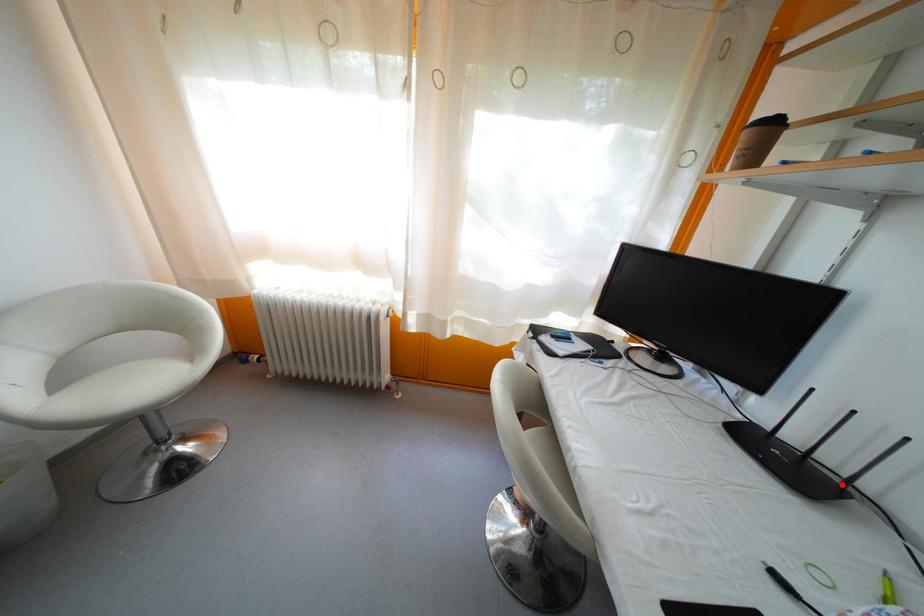
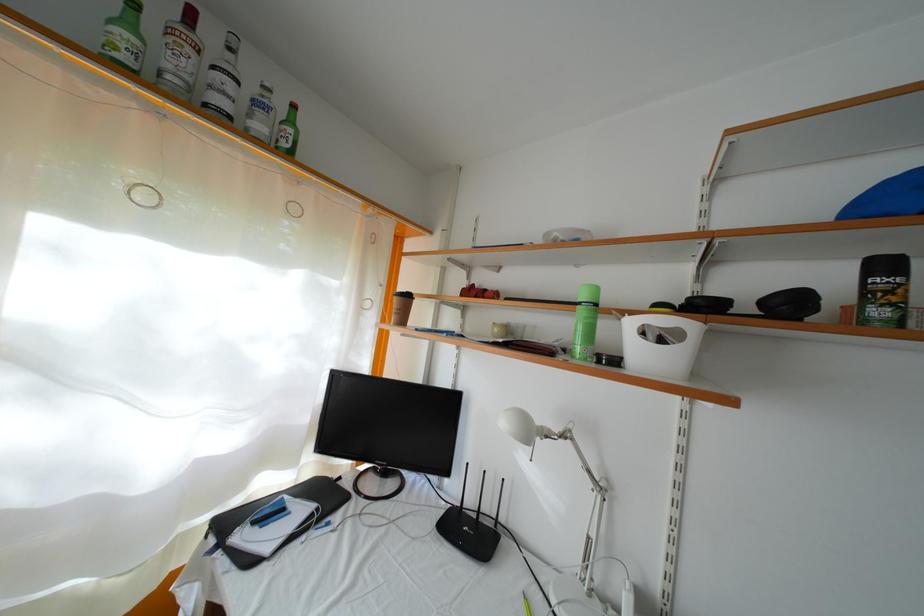
Question: I am providing you with two images of the same scene from different viewpoints. A red point is marked on the first image. Is the red point's position out of view in image 2?

Choices:
 (A) Yes
 (B) No

Answer: (B)